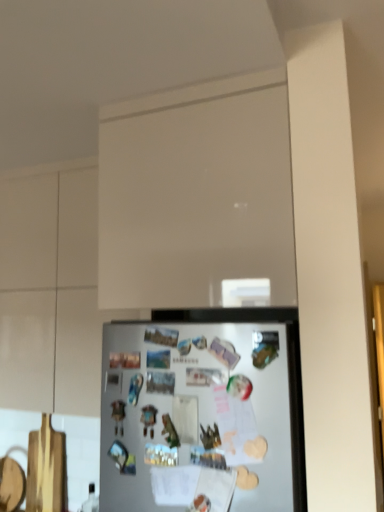
Question: Is white matte refrigerator at lower center at the right side of white matte cabinet at upper center?

Choices:
 (A) yes
 (B) no

Answer: (A)

Question: From the image's perspective, is white matte refrigerator at lower center on white matte cabinet at upper center?

Choices:
 (A) yes
 (B) no

Answer: (B)

Question: Can you confirm if white matte refrigerator at lower center is positioned to the left of white matte cabinet at upper center?

Choices:
 (A) no
 (B) yes

Answer: (A)

Question: Does white matte refrigerator at lower center have a greater width compared to white matte cabinet at upper center?

Choices:
 (A) no
 (B) yes

Answer: (A)

Question: Can you confirm if white matte refrigerator at lower center is taller than white matte cabinet at upper center?

Choices:
 (A) yes
 (B) no

Answer: (B)

Question: Are white matte refrigerator at lower center and white matte cabinet at upper center making contact?

Choices:
 (A) no
 (B) yes

Answer: (A)

Question: Considering the relative positions of white matte glass door at upper center and white matte refrigerator at lower center in the image provided, is white matte glass door at upper center behind white matte refrigerator at lower center?

Choices:
 (A) yes
 (B) no

Answer: (A)

Question: Considering the relative sizes of white matte glass door at upper center and white matte refrigerator at lower center in the image provided, is white matte glass door at upper center thinner than white matte refrigerator at lower center?

Choices:
 (A) yes
 (B) no

Answer: (B)

Question: Is white matte glass door at upper center taller than white matte refrigerator at lower center?

Choices:
 (A) yes
 (B) no

Answer: (A)

Question: Can you confirm if white matte glass door at upper center is smaller than white matte refrigerator at lower center?

Choices:
 (A) yes
 (B) no

Answer: (B)

Question: Is white matte glass door at upper center outside of white matte refrigerator at lower center?

Choices:
 (A) no
 (B) yes

Answer: (B)

Question: From a real-world perspective, is white matte glass door at upper center over white matte refrigerator at lower center?

Choices:
 (A) no
 (B) yes

Answer: (B)

Question: Is the depth of white matte glass door at upper center less than that of white matte cabinet at upper center?

Choices:
 (A) yes
 (B) no

Answer: (A)